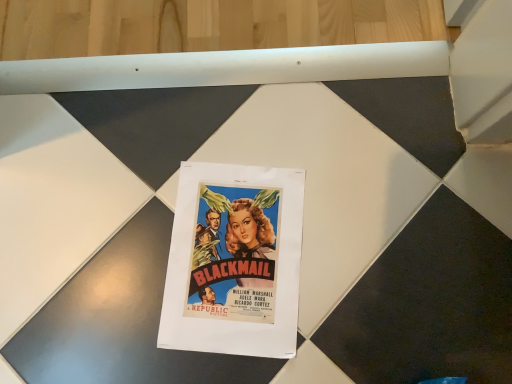
This screenshot has width=512, height=384. What do you see at coordinates (234, 261) in the screenshot? I see `matte paper poster at center` at bounding box center [234, 261].

Identify the location of matte paper poster at center. (234, 261).

Identify the location of matte paper poster at center. (234, 261).